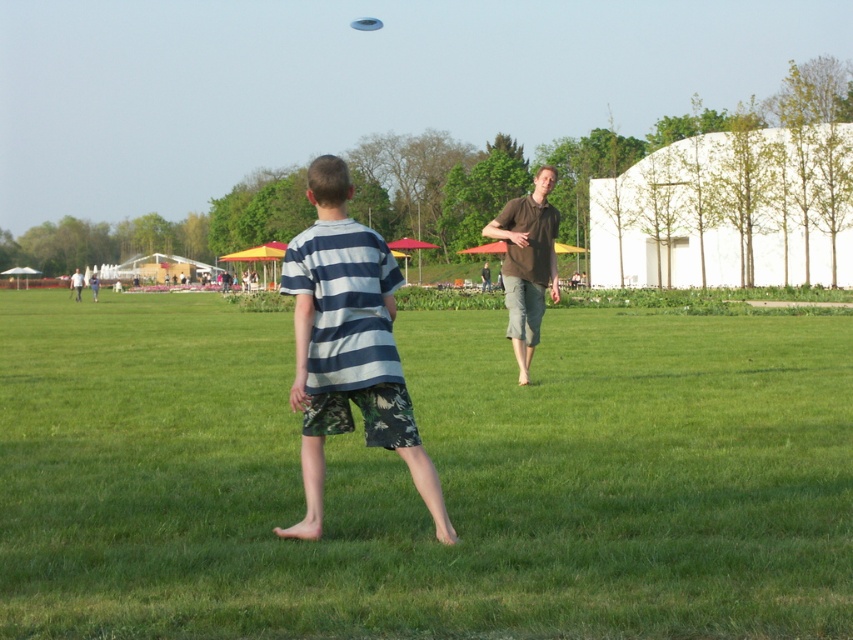
Question: Does brown cotton shirt at center lie in front of blue plastic frisbee at upper center?

Choices:
 (A) no
 (B) yes

Answer: (B)

Question: Which point is closer to the camera?

Choices:
 (A) (527, 291)
 (B) (230, 442)
 (C) (360, 17)

Answer: (B)

Question: Which point is farther to the camera?

Choices:
 (A) (370, 17)
 (B) (492, 472)
 (C) (405, 451)
 (D) (552, 252)

Answer: (A)

Question: Which of the following is the closest to the observer?

Choices:
 (A) green grass at center
 (B) brown cotton shirt at center

Answer: (A)

Question: Does brown cotton shirt at center appear on the left side of blue plastic frisbee at upper center?

Choices:
 (A) yes
 (B) no

Answer: (B)

Question: Can you confirm if striped cotton shirt at center is positioned below brown cotton shirt at center?

Choices:
 (A) yes
 (B) no

Answer: (A)